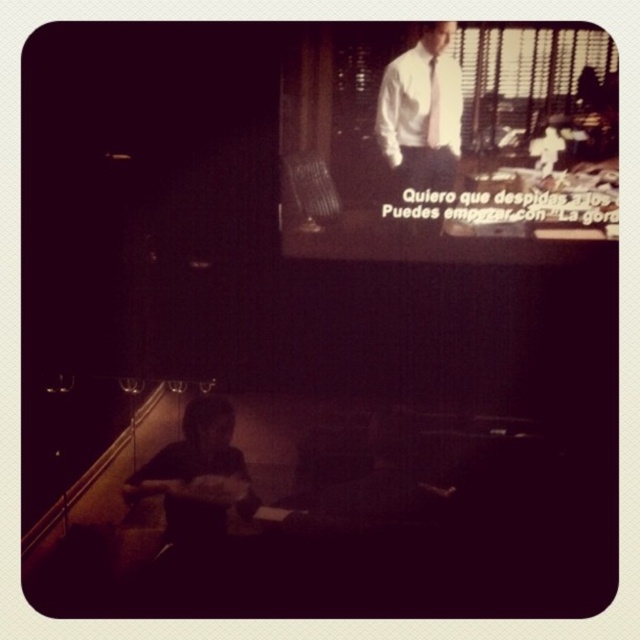
Question: Is white shirt and tie at upper center thinner than white silk tie at upper center?

Choices:
 (A) yes
 (B) no

Answer: (B)

Question: Is white shirt and tie at upper center closer to the viewer compared to white silk tie at upper center?

Choices:
 (A) yes
 (B) no

Answer: (A)

Question: Which of the following is the closest to the observer?

Choices:
 (A) white shirt and tie at upper center
 (B) white silk tie at upper center

Answer: (A)

Question: Which object is closer to the camera taking this photo?

Choices:
 (A) white silk tie at upper center
 (B) white shirt and tie at upper center

Answer: (B)

Question: Which point is farther to the camera?

Choices:
 (A) white silk tie at upper center
 (B) white shirt and tie at upper center

Answer: (A)

Question: Is white shirt and tie at upper center to the right of white silk tie at upper center from the viewer's perspective?

Choices:
 (A) yes
 (B) no

Answer: (B)